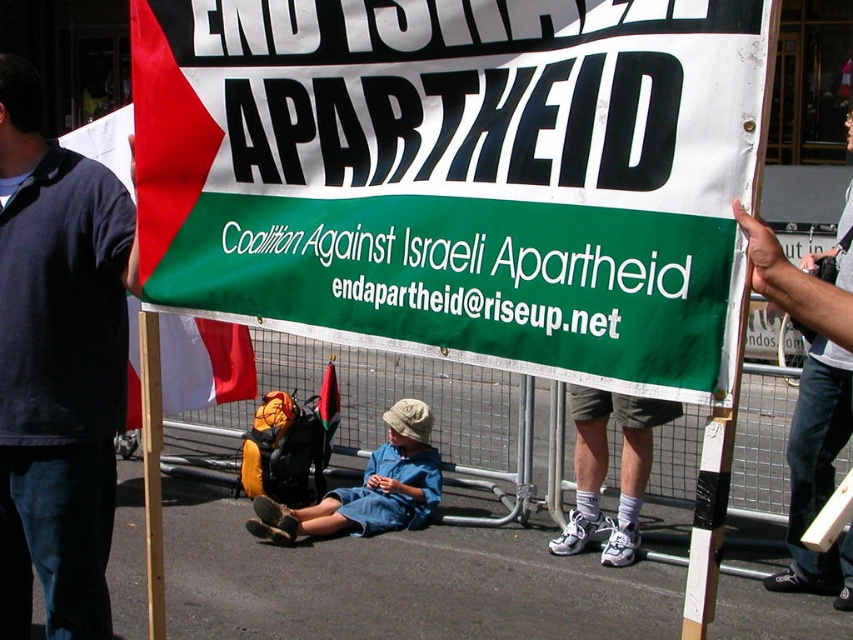
Which of these two, white paper banner at center or dark blue polo shirt at left, stands taller?

dark blue polo shirt at left is taller.

Can you confirm if white paper banner at center is thinner than dark blue polo shirt at left?

No, white paper banner at center is not thinner than dark blue polo shirt at left.

In the scene shown: Who is more forward, [236,52] or [30,376]?

Point [236,52] is more forward.

This screenshot has height=640, width=853. I want to click on white paper banner at center, so click(x=457, y=176).

Can you confirm if red fabric flag at upper left is smaller than green fabric flag at center?

No.

Who is higher up, red fabric flag at upper left or green fabric flag at center?

red fabric flag at upper left

Identify the location of red fabric flag at upper left. The height and width of the screenshot is (640, 853). (202, 362).

Where is `red fabric flag at upper left`? red fabric flag at upper left is located at coordinates (202, 362).

Which is more to the left, dark blue polo shirt at left or green fabric flag at center?

From the viewer's perspective, dark blue polo shirt at left appears more on the left side.

Does point (44, 403) come in front of point (325, 396)?

Yes, point (44, 403) is in front of point (325, 396).

Locate an element on the screen. dark blue polo shirt at left is located at coordinates (57, 368).

This screenshot has height=640, width=853. Identify the location of dark blue polo shirt at left. (57, 368).